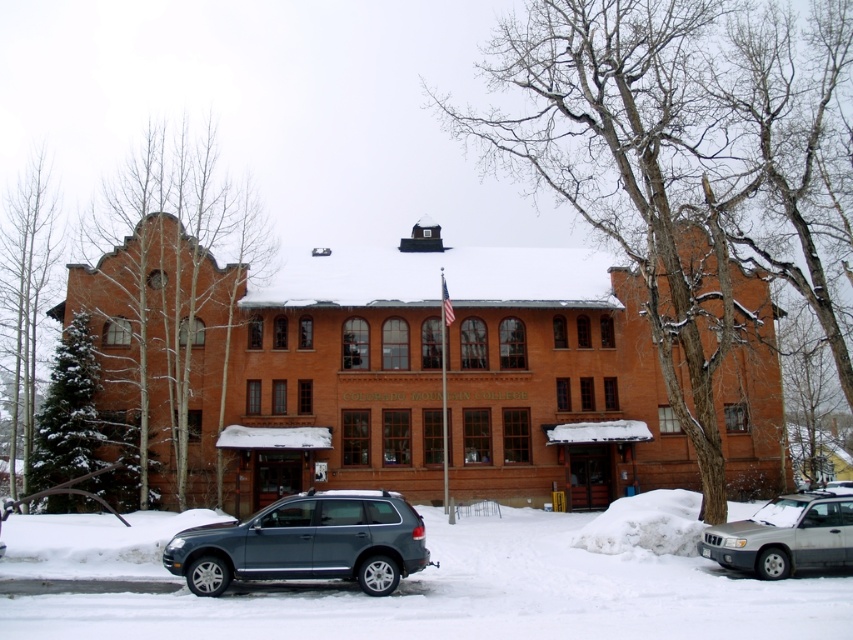
You are a delivery driver approaching the Colorado Mountain College building. You need to park your silver metallic suv at lower right close to the white powdery snow at lower center where the entrance is. Given that the parking spaces are 10 feet wide each, how many parking spaces away from the entrance should you park to be within 40 feet?

The distance between the silver metallic suv at lower right and the white powdery snow at lower center is 37.52 feet. Since each parking space is 10 feet wide, you should park within 4 parking spaces away to stay within 40 feet.

You are standing at the entrance of the Colorado Mountain College building and want to park your metallic gray suv at center. The parking lot is located at point (306,541). Can you determine the direction you should head to reach the parking lot?

The metallic gray suv at center is already located at point (306,541), so you are already at the parking lot.

Looking at this image, you are a delivery person arriving at the Colorado Mountain College building. You see the white powdery snow at lower center and the silver metallic suv at lower right. Which object is higher in elevation compared to the other?

The white powdery snow at lower center is much taller than the silver metallic suv at lower right, so the white powdery snow at lower center is higher in elevation.